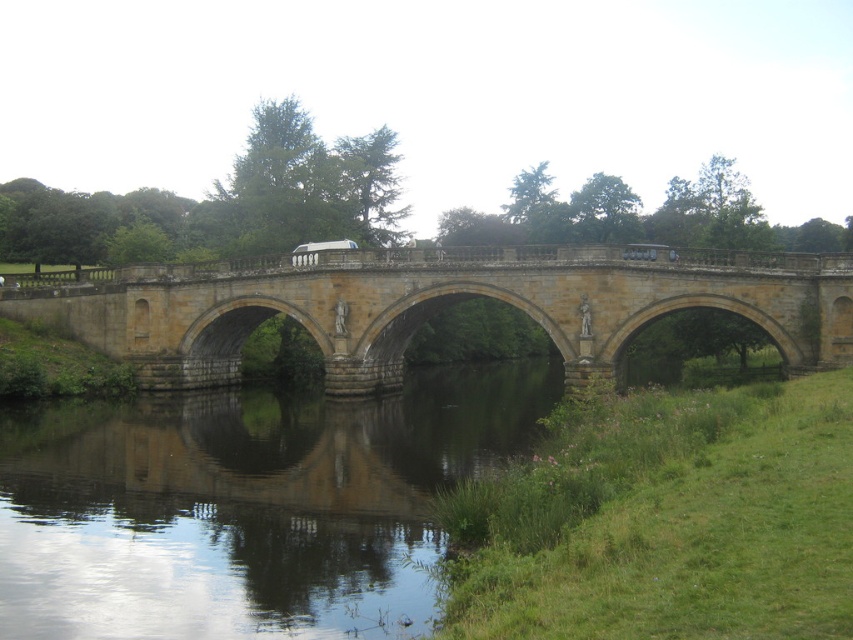
Does smooth reflective water at center have a lesser width compared to stone bridge at center?

Correct, smooth reflective water at center's width is less than stone bridge at center's.

Who is higher up, smooth reflective water at center or stone bridge at center?

Positioned higher is stone bridge at center.

Is point (386, 538) behind point (595, 260)?

No, it is not.

Where is `smooth reflective water at center`? smooth reflective water at center is located at coordinates (245, 506).